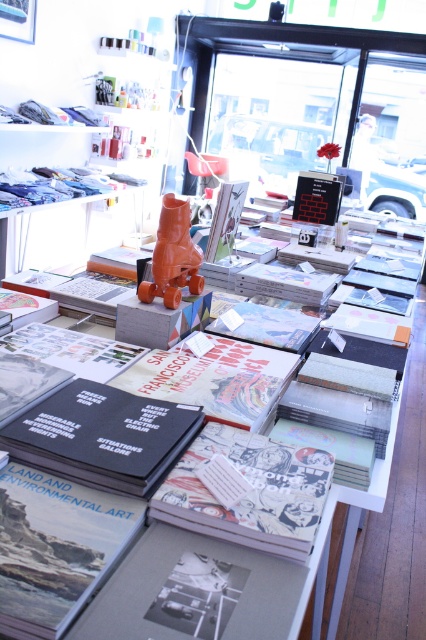
Based on the photo, can you confirm if comic book paper at center is positioned to the right of orange matte sculpture at center?

Yes, comic book paper at center is to the right of orange matte sculpture at center.

Does comic book paper at center have a greater width compared to orange matte sculpture at center?

Indeed, comic book paper at center has a greater width compared to orange matte sculpture at center.

Is point (259, 486) positioned before point (178, 221)?

Yes, it is.

This screenshot has height=640, width=426. I want to click on comic book paper at center, so click(250, 492).

Is matte black book at center to the right of orange matte sculpture at center from the viewer's perspective?

In fact, matte black book at center is to the left of orange matte sculpture at center.

Is matte black book at center above orange matte sculpture at center?

Incorrect, matte black book at center is not positioned above orange matte sculpture at center.

Which is behind, point (71, 497) or point (155, 253)?

Positioned behind is point (155, 253).

Find the location of `matte black book at center`. matte black book at center is located at coordinates (55, 547).

Is point (0, 561) more distant than point (192, 522)?

That is False.

Is matte black book at center positioned at the back of comic book paper at center?

No, it is not.

Measure the distance between matte black book at center and camera.

matte black book at center and camera are 68.39 centimeters apart from each other.

Identify the location of matte black book at center. This screenshot has width=426, height=640. (55, 547).